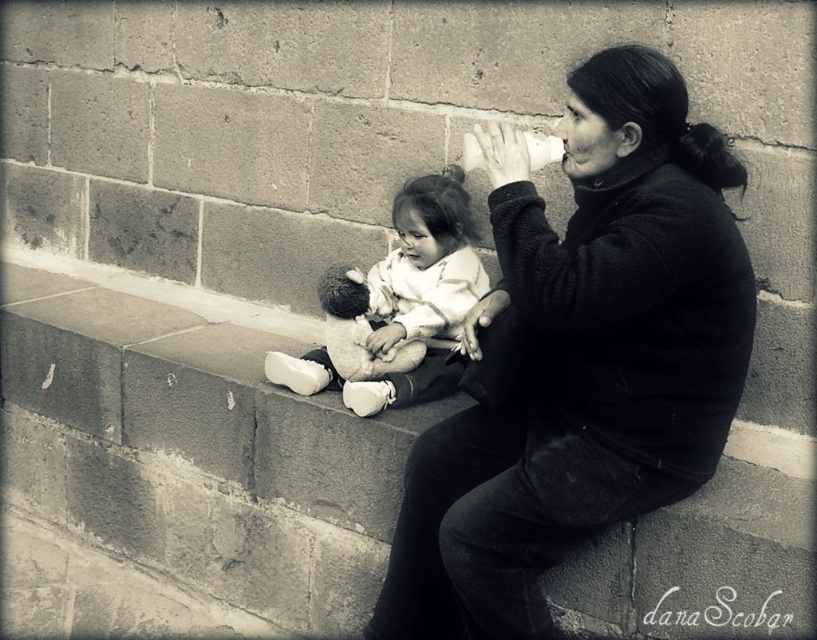
You are a photographer trying to capture a closeup of the matte black jacket at center and the white plush doll at center. What is the minimum distance you need to set your camera lens to focus on both objects simultaneously?

The minimum distance your camera lens needs to be set to focus on both the matte black jacket at center and the white plush doll at center is 25.42 inches, as they are positioned 25.42 inches apart from each other.

You are a photographer trying to capture a closeup shot of the white plush doll at center without including the matte black jacket at center in the frame. Given their sizes, is this possible?

The matte black jacket at center is larger in size than white plush doll at center, so it might be challenging to frame the doll without including the jacket, especially if they are both positioned at the center of the image.